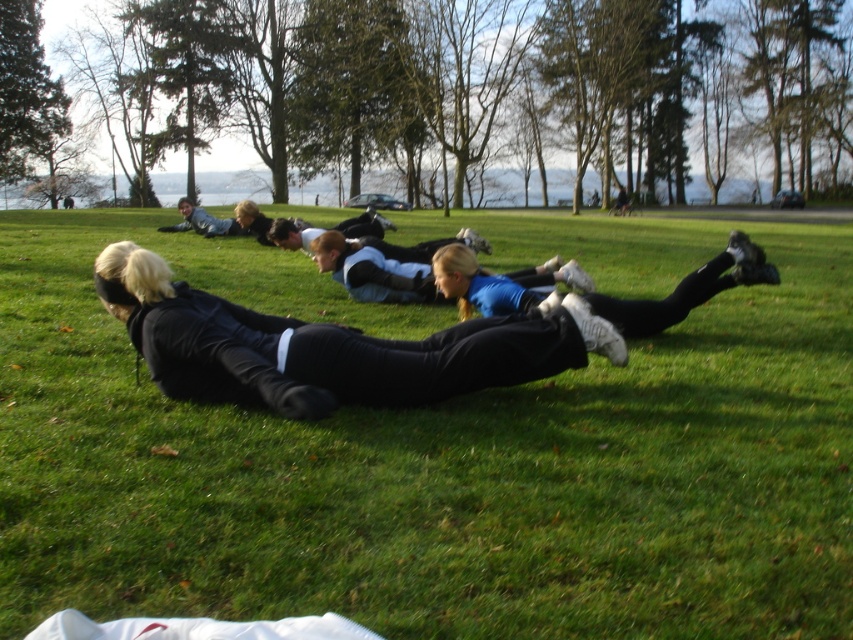
Which is behind, point (202, 336) or point (323, 269)?

Point (323, 269)

Can you confirm if black matte leggings at center is smaller than blue fabric shirt at center?

Actually, black matte leggings at center might be larger than blue fabric shirt at center.

The image size is (853, 640). Find the location of `black matte leggings at center`. black matte leggings at center is located at coordinates (322, 348).

Can you confirm if green grass at center is positioned to the left of black matte leggings at center?

Incorrect, green grass at center is not on the left side of black matte leggings at center.

Is green grass at center below black matte leggings at center?

No.

Is point (401, 586) closer to camera compared to point (154, 305)?

Yes.

What are the coordinates of `green grass at center` in the screenshot? It's located at (439, 451).

Who is lower down, green grass at center or blue fabric shirt at center?

blue fabric shirt at center is lower down.

Does green grass at center appear under blue fabric shirt at center?

No, green grass at center is not below blue fabric shirt at center.

This screenshot has width=853, height=640. What do you see at coordinates (439, 451) in the screenshot? I see `green grass at center` at bounding box center [439, 451].

Where is `green grass at center`? green grass at center is located at coordinates (439, 451).